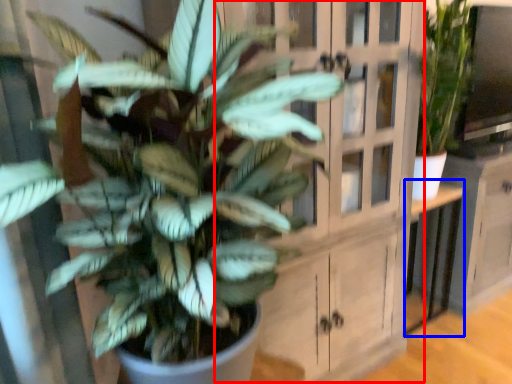
Question: Which point is closer to the camera, dresser (highlighted by a red box) or table (highlighted by a blue box)?

Choices:
 (A) dresser
 (B) table

Answer: (A)